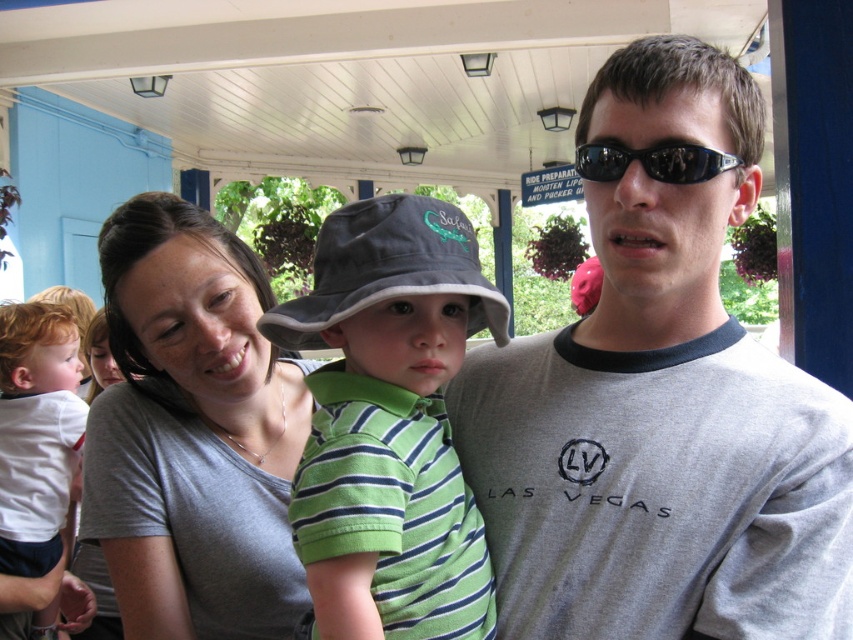
You are a photographer adjusting your camera settings while focusing on the matte gray shirt at center and the black plastic sunglasses at center. Which object should you focus on first to ensure it appears sharp in the photo?

Result: The matte gray shirt at center is closer to you than the black plastic sunglasses at center, so you should focus on the matte gray shirt at center first to ensure it appears sharp in the photo.

From the picture: You are standing in front of the scene and notice the matte gray shirt at center. Can you determine its exact position using the coordinate system provided?

The matte gray shirt at center is located at point (193, 433) according to the coordinate system provided.